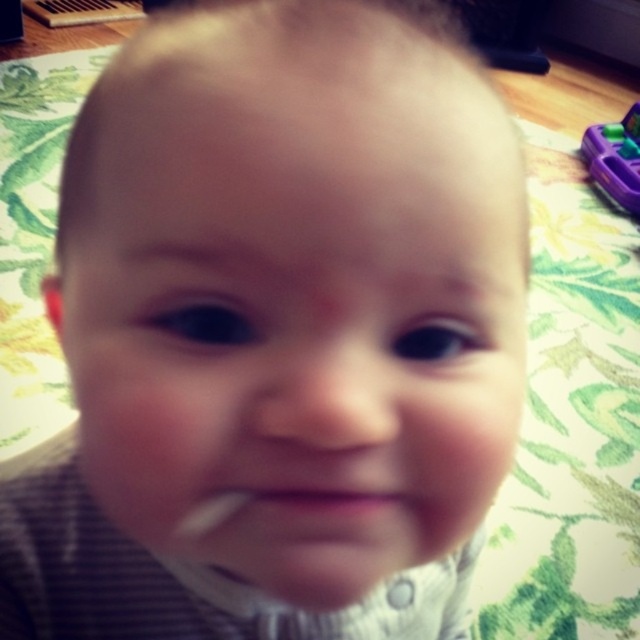
Is pink matte lips at center taller than white plastic toothbrush at lower center?

No, pink matte lips at center is not taller than white plastic toothbrush at lower center.

Can you confirm if pink matte lips at center is smaller than white plastic toothbrush at lower center?

Yes, pink matte lips at center is smaller than white plastic toothbrush at lower center.

Is point (342, 502) farther from viewer compared to point (218, 502)?

No, (342, 502) is closer to viewer.

Locate an element on the screen. pink matte lips at center is located at coordinates (326, 499).

From the picture: Between purple plastic toy at upper right and pink matte lips at center, which one has more height?

purple plastic toy at upper right

Locate an element on the screen. purple plastic toy at upper right is located at coordinates (616, 160).

The width and height of the screenshot is (640, 640). Describe the element at coordinates (616, 160) in the screenshot. I see `purple plastic toy at upper right` at that location.

This screenshot has width=640, height=640. Identify the location of purple plastic toy at upper right. (616, 160).

Image resolution: width=640 pixels, height=640 pixels. Describe the element at coordinates (616, 160) in the screenshot. I see `purple plastic toy at upper right` at that location.

Does purple plastic toy at upper right have a greater height compared to white plastic toothbrush at lower center?

Indeed, purple plastic toy at upper right has a greater height compared to white plastic toothbrush at lower center.

Is point (625, 200) in front of point (236, 496)?

That is False.

You are a GUI agent. You are given a task and a screenshot of the screen. Output one action in this format:
    pyautogui.click(x=<x>, y=<y>)
    Task: Click on the purple plastic toy at upper right
    
    Given the screenshot: What is the action you would take?
    pyautogui.click(x=616, y=160)